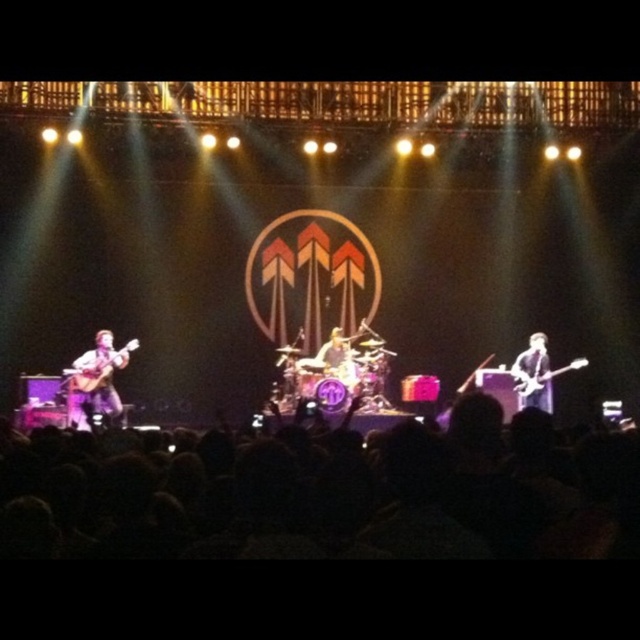
You are a photographer at the concert and want to capture a clear shot of both the glossy black guitar at right and the glossy electric guitar at right. Since you want both guitars to be in focus, which one should you focus on first?

The glossy black guitar at right is in front of the glossy electric guitar at right, so you should focus on the glossy black guitar at right first to ensure both are in focus.

You are a photographer at the concert. You want to take a photo that focuses on the shiny silver guitar at center without having the black fabric crowd at lower center in the foreground. Is this possible?

The black fabric crowd at lower center is closer to the viewer than the shiny silver guitar at center. To avoid having the crowd in the foreground, the photographer would need to adjust their position or use a longer lens to focus on the guitar while minimizing the crowd in the frame.

You are a photographer at the concert and want to capture a photo that includes both the black fabric crowd at lower center and the shiny silver guitar at center. Based on their positions, which object should be placed on the left side of the photo to ensure both are visible?

The black fabric crowd at lower center is wider than the shiny silver guitar at center, so to ensure both are visible in the photo, the shiny silver guitar at center should be placed on the left side.